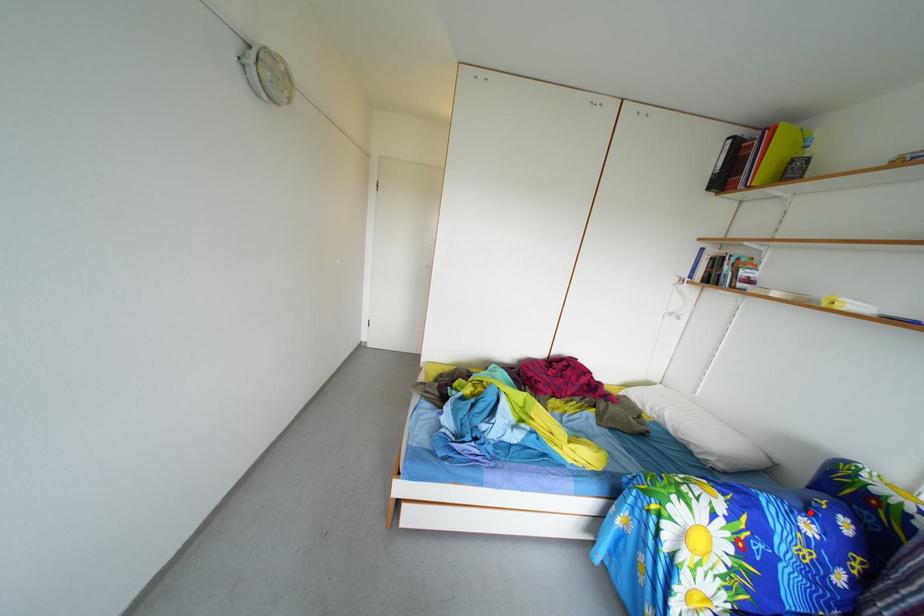
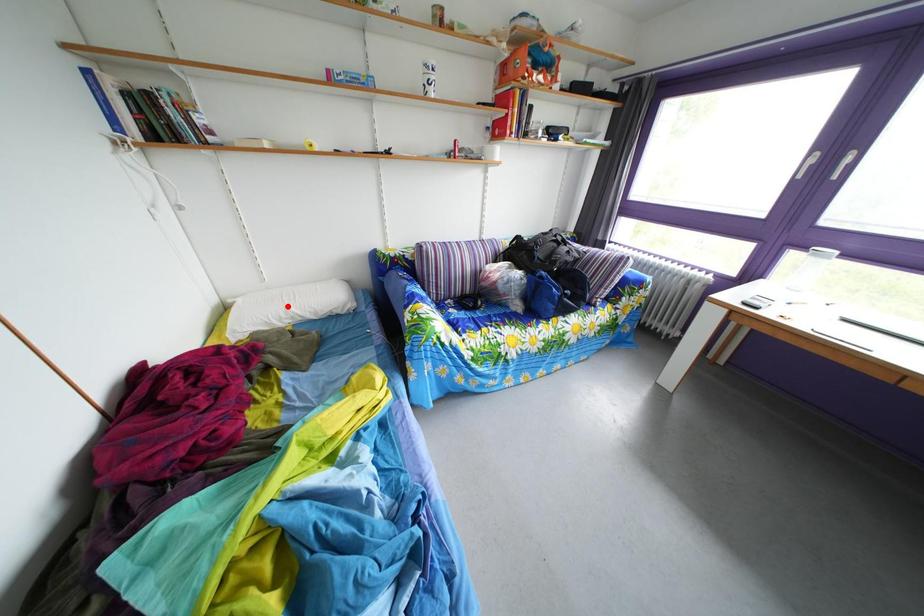
I am providing you with two images of the same scene from different viewpoints. A red point is marked on the first image and another point is marked on the second image. Is the red point in image1 aligned with the point shown in image2?

No